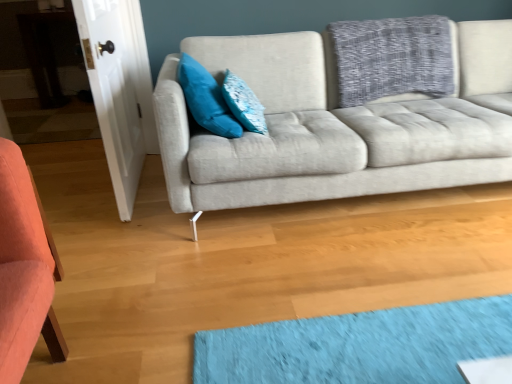
Question: From a real-world perspective, is textured blue pillow at center, the 2th pillow positioned from the left, on top of teal velvet pillow at upper left, the first pillow from the left?

Choices:
 (A) yes
 (B) no

Answer: (B)

Question: Can you confirm if textured blue pillow at center, the 2th pillow positioned from the left, is taller than teal velvet pillow at upper left, placed as the second pillow when sorted from right to left?

Choices:
 (A) yes
 (B) no

Answer: (B)

Question: Considering the relative sizes of textured blue pillow at center, acting as the 1th pillow starting from the right, and teal velvet pillow at upper left, the first pillow from the left, in the image provided, is textured blue pillow at center, acting as the 1th pillow starting from the right, bigger than teal velvet pillow at upper left, the first pillow from the left,?

Choices:
 (A) no
 (B) yes

Answer: (A)

Question: Does textured blue pillow at center, acting as the 1th pillow starting from the right, turn towards teal velvet pillow at upper left, placed as the second pillow when sorted from right to left?

Choices:
 (A) yes
 (B) no

Answer: (B)

Question: From a real-world perspective, is textured blue pillow at center, the 2th pillow positioned from the left, beneath teal velvet pillow at upper left, placed as the second pillow when sorted from right to left?

Choices:
 (A) yes
 (B) no

Answer: (A)

Question: In terms of size, does textured blue pillow at center, the 2th pillow positioned from the left, appear bigger or smaller than light gray fabric couch at center?

Choices:
 (A) big
 (B) small

Answer: (B)

Question: Is textured blue pillow at center, acting as the 1th pillow starting from the right, wider or thinner than light gray fabric couch at center?

Choices:
 (A) thin
 (B) wide

Answer: (A)

Question: From a real-world perspective, is textured blue pillow at center, acting as the 1th pillow starting from the right, above or below light gray fabric couch at center?

Choices:
 (A) above
 (B) below

Answer: (A)

Question: Is textured blue pillow at center, the 2th pillow positioned from the left, spatially inside light gray fabric couch at center, or outside of it?

Choices:
 (A) inside
 (B) outside

Answer: (A)

Question: Considering the positions of point (216, 124) and point (231, 84), is point (216, 124) closer or farther from the camera than point (231, 84)?

Choices:
 (A) farther
 (B) closer

Answer: (B)

Question: Is teal velvet pillow at upper left, placed as the second pillow when sorted from right to left, spatially inside textured blue pillow at center, acting as the 1th pillow starting from the right, or outside of it?

Choices:
 (A) outside
 (B) inside

Answer: (A)

Question: Is teal velvet pillow at upper left, the first pillow from the left, to the left or to the right of textured blue pillow at center, the 2th pillow positioned from the left, in the image?

Choices:
 (A) left
 (B) right

Answer: (A)

Question: From a real-world perspective, relative to textured blue pillow at center, the 2th pillow positioned from the left, is teal velvet pillow at upper left, placed as the second pillow when sorted from right to left, vertically above or below?

Choices:
 (A) below
 (B) above

Answer: (B)

Question: In the image, is textured blue pillow at center, the 2th pillow positioned from the left, positioned in front of or behind teal velvet pillow at upper left, the first pillow from the left?

Choices:
 (A) behind
 (B) front

Answer: (A)

Question: From a real-world perspective, is textured blue pillow at center, acting as the 1th pillow starting from the right, positioned above or below teal velvet pillow at upper left, the first pillow from the left?

Choices:
 (A) below
 (B) above

Answer: (A)